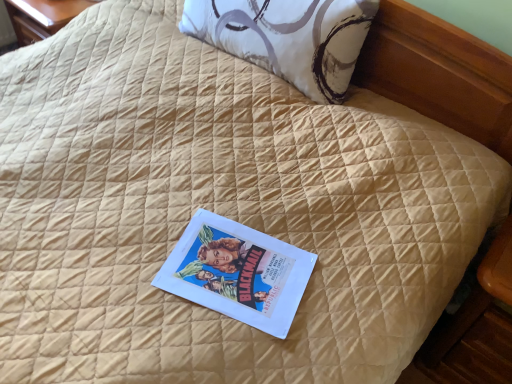
Find the location of a particular element. This screenshot has width=512, height=384. free space above matte paper book at center (from a real-world perspective) is located at coordinates (244, 259).